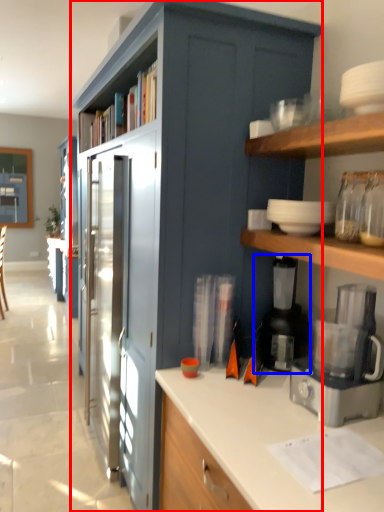
Question: Which point is closer to the camera, cabinetry (highlighted by a red box) or appliance (highlighted by a blue box)?

Choices:
 (A) cabinetry
 (B) appliance

Answer: (A)